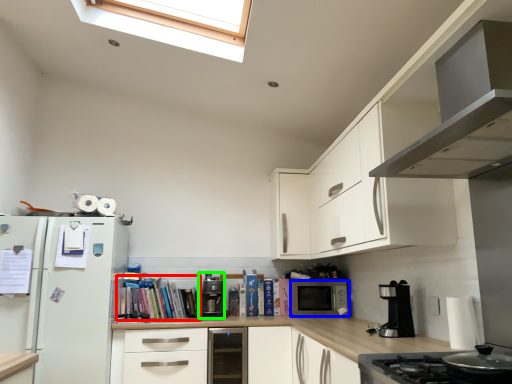
Question: Which is nearer to the book (highlighted by a red box)? microwave oven (highlighted by a blue box) or coffee machine (highlighted by a green box).

Choices:
 (A) microwave oven
 (B) coffee machine

Answer: (B)